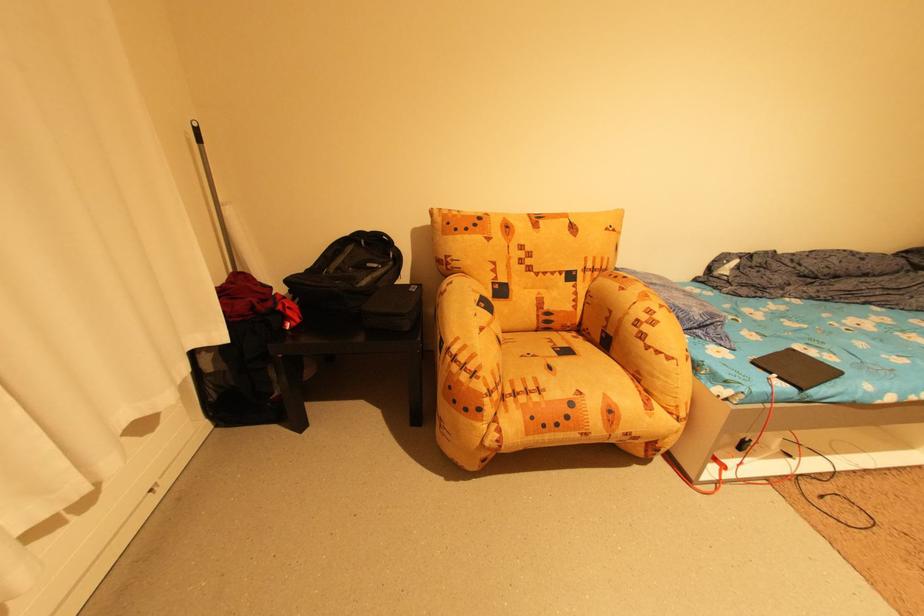
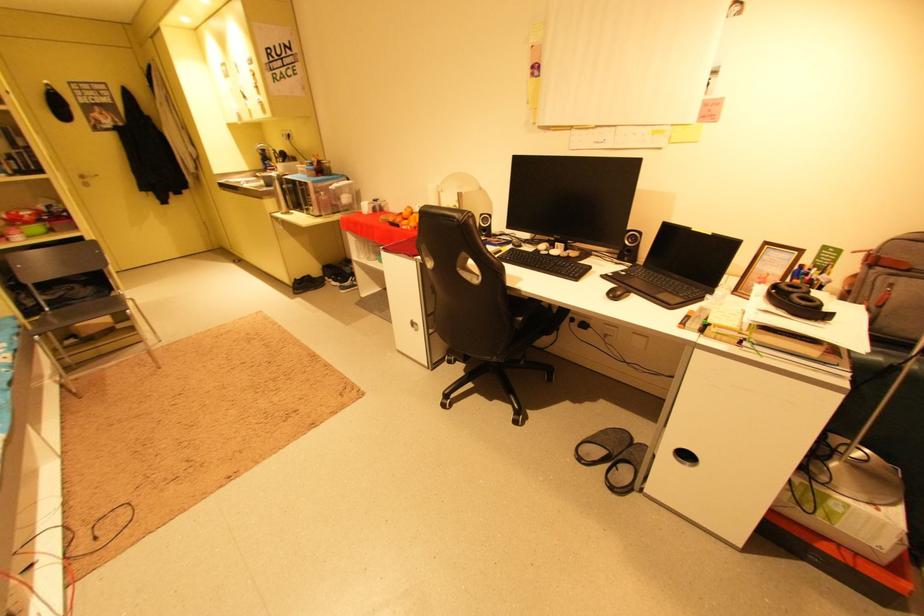
Find the pixel in the second image that matches (x=783, y=477) in the first image.

(73, 578)